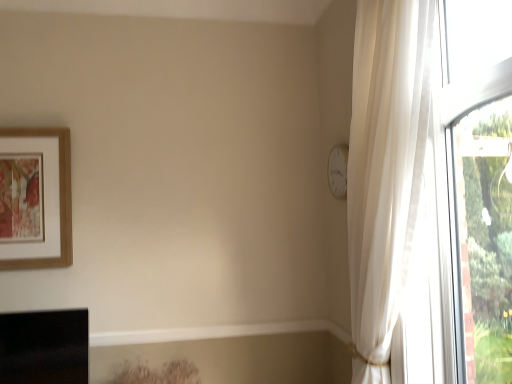
Question: Looking at the image, does white matte clock at upper right seem bigger or smaller compared to wooden-framed artwork at upper left?

Choices:
 (A) big
 (B) small

Answer: (B)

Question: Does point (332, 148) appear closer or farther from the camera than point (67, 183)?

Choices:
 (A) closer
 (B) farther

Answer: (B)

Question: From a real-world perspective, relative to wooden-framed artwork at upper left, is white matte clock at upper right vertically above or below?

Choices:
 (A) above
 (B) below

Answer: (A)

Question: Looking at the image, does wooden-framed artwork at upper left seem bigger or smaller compared to white matte clock at upper right?

Choices:
 (A) big
 (B) small

Answer: (A)

Question: In terms of height, does wooden-framed artwork at upper left look taller or shorter compared to white matte clock at upper right?

Choices:
 (A) tall
 (B) short

Answer: (A)

Question: From the image's perspective, relative to white matte clock at upper right, is wooden-framed artwork at upper left above or below?

Choices:
 (A) below
 (B) above

Answer: (A)

Question: Which is correct: wooden-framed artwork at upper left is inside white matte clock at upper right, or outside of it?

Choices:
 (A) inside
 (B) outside

Answer: (B)